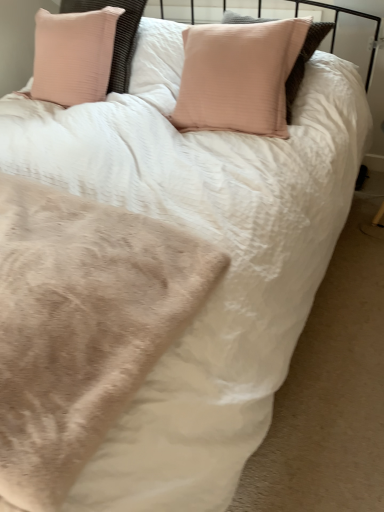
Question: Is pink plush pillow at upper left bigger than beige plush blanket at lower left?

Choices:
 (A) no
 (B) yes

Answer: (B)

Question: Is pink plush pillow at upper left with beige plush blanket at lower left?

Choices:
 (A) no
 (B) yes

Answer: (A)

Question: Is beige plush blanket at lower left inside pink plush pillow at upper left?

Choices:
 (A) no
 (B) yes

Answer: (A)

Question: Is pink plush pillow at upper left shorter than beige plush blanket at lower left?

Choices:
 (A) no
 (B) yes

Answer: (A)

Question: Is pink plush pillow at upper left wider than beige plush blanket at lower left?

Choices:
 (A) yes
 (B) no

Answer: (B)

Question: From the image's perspective, is pink plush pillow at upper left located beneath beige plush blanket at lower left?

Choices:
 (A) yes
 (B) no

Answer: (B)

Question: From the image's perspective, is beige plush blanket at lower left located above pink plush pillow at upper left?

Choices:
 (A) no
 (B) yes

Answer: (A)

Question: From a real-world perspective, is beige plush blanket at lower left under pink plush pillow at upper left?

Choices:
 (A) no
 (B) yes

Answer: (B)

Question: Is beige plush blanket at lower left shorter than pink plush pillow at upper left?

Choices:
 (A) no
 (B) yes

Answer: (B)

Question: Is beige plush blanket at lower left in front of pink plush pillow at upper left?

Choices:
 (A) yes
 (B) no

Answer: (A)

Question: Is beige plush blanket at lower left taller than pink plush pillow at upper left?

Choices:
 (A) yes
 (B) no

Answer: (B)

Question: Can we say beige plush blanket at lower left lies outside pink plush pillow at upper left?

Choices:
 (A) no
 (B) yes

Answer: (B)

Question: Considering the positions of beige plush blanket at lower left and pink plush pillow at upper left in the image, is beige plush blanket at lower left taller or shorter than pink plush pillow at upper left?

Choices:
 (A) short
 (B) tall

Answer: (A)